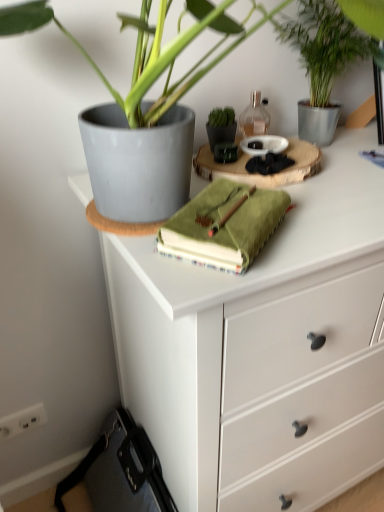
The height and width of the screenshot is (512, 384). What do you see at coordinates (262, 349) in the screenshot?
I see `white matte chest of drawers at upper center` at bounding box center [262, 349].

Locate an element on the screen. The image size is (384, 512). white matte chest of drawers at upper center is located at coordinates (262, 349).

Describe the element at coordinates (224, 225) in the screenshot. This screenshot has width=384, height=512. I see `green suede journal at center` at that location.

In order to face green matte flowerpot at center, should I rotate leftwards or rightwards?

To face it directly, rotate right by 4.324 degrees.

Where is `translucent glass bottle at upper center`? The height and width of the screenshot is (512, 384). translucent glass bottle at upper center is located at coordinates (254, 117).

Does green suede journal at center contain green matte flowerpot at center?

Actually, green matte flowerpot at center is outside green suede journal at center.

Is green suede journal at center in front of or behind green matte flowerpot at center in the image?

Clearly, green suede journal at center is in front of green matte flowerpot at center.

Consider the image. Are green suede journal at center and green matte flowerpot at center located far from each other?

Actually, green suede journal at center and green matte flowerpot at center are a little close together.

Measure the distance from green suede journal at center to green matte flowerpot at center.

green suede journal at center is 11.82 inches away from green matte flowerpot at center.

In the scene shown: Is white matte chest of drawers at upper center in front of or behind translucent glass bottle at upper center in the image?

In the image, white matte chest of drawers at upper center appears in front of translucent glass bottle at upper center.

Can you confirm if white matte chest of drawers at upper center is shorter than translucent glass bottle at upper center?

No.

Consider the image. Is the surface of white matte chest of drawers at upper center in direct contact with translucent glass bottle at upper center?

white matte chest of drawers at upper center is not next to translucent glass bottle at upper center, and they're not touching.

From a real-world perspective, is white matte chest of drawers at upper center under translucent glass bottle at upper center?

Yes, from a real-world perspective, white matte chest of drawers at upper center is beneath translucent glass bottle at upper center.

Is translucent glass bottle at upper center far away from green suede journal at center?

Actually, translucent glass bottle at upper center and green suede journal at center are a little close together.

Could you tell me if translucent glass bottle at upper center is turned towards green suede journal at center?

No.

From a real-world perspective, is translucent glass bottle at upper center above or below green suede journal at center?

translucent glass bottle at upper center is above green suede journal at center.

Considering their positions, is translucent glass bottle at upper center located in front of or behind green suede journal at center?

Clearly, translucent glass bottle at upper center is behind green suede journal at center.

Does point (366, 38) come closer to viewer compared to point (306, 293)?

No, (366, 38) is behind (306, 293).

Who is shorter, green leafy plant at upper right or white matte chest of drawers at upper center?

Standing shorter between the two is green leafy plant at upper right.

Can you confirm if green leafy plant at upper right is thinner than white matte chest of drawers at upper center?

Yes, green leafy plant at upper right is thinner than white matte chest of drawers at upper center.

In the scene shown: Can you tell me how much green suede journal at center and white matte chest of drawers at upper center differ in facing direction?

The facing directions of green suede journal at center and white matte chest of drawers at upper center are 30.5 degrees apart.

Which of these two, green suede journal at center or white matte chest of drawers at upper center, stands taller?

With more height is white matte chest of drawers at upper center.

Is the surface of green suede journal at center in direct contact with white matte chest of drawers at upper center?

No, green suede journal at center is not touching white matte chest of drawers at upper center.

From a real-world perspective, between green suede journal at center and white matte chest of drawers at upper center, who is vertically higher?

From a 3D spatial view, green suede journal at center is above.

From the picture: Considering the sizes of objects green matte flowerpot at center and translucent glass bottle at upper center in the image provided, who is bigger, green matte flowerpot at center or translucent glass bottle at upper center?

translucent glass bottle at upper center.

Based on the photo, is green matte flowerpot at center to the left or to the right of translucent glass bottle at upper center in the image?

green matte flowerpot at center is to the left of translucent glass bottle at upper center.

From a real-world perspective, who is located lower, green matte flowerpot at center or translucent glass bottle at upper center?

green matte flowerpot at center is physically lower.

Which is in front, point (222, 141) or point (255, 130)?

Point (222, 141)

Is translucent glass bottle at upper center positioned with its back to green matte flowerpot at center?

No.

How many degrees apart are the facing directions of translucent glass bottle at upper center and green matte flowerpot at center?

There is a 1.47-degree angle between the facing directions of translucent glass bottle at upper center and green matte flowerpot at center.

Who is bigger, translucent glass bottle at upper center or green matte flowerpot at center?

translucent glass bottle at upper center is bigger.

In terms of width, does translucent glass bottle at upper center look wider or thinner when compared to green matte flowerpot at center?

Clearly, translucent glass bottle at upper center has more width compared to green matte flowerpot at center.

Image resolution: width=384 pixels, height=512 pixels. In order to click on journal below the green matte flowerpot at center (from the image's perspective) in this screenshot , I will do `click(224, 225)`.

Where is `bottle that is behind the white matte chest of drawers at upper center`? This screenshot has height=512, width=384. bottle that is behind the white matte chest of drawers at upper center is located at coordinates (254, 117).

Which object lies further to the anchor point translucent glass bottle at upper center, green matte flowerpot at center or green leafy plant at upper right?

Among the two, green leafy plant at upper right is located further to translucent glass bottle at upper center.

Looking at the image, which one is located closer to green leafy plant at upper right, green matte flowerpot at center or translucent glass bottle at upper center?

Among the two, translucent glass bottle at upper center is located nearer to green leafy plant at upper right.

From the image, which object appears to be nearer to green leafy plant at upper right, green suede journal at center or green matte flowerpot at center?

green matte flowerpot at center.

Considering their positions, is green suede journal at center positioned further to green matte flowerpot at center than translucent glass bottle at upper center?

green suede journal at center is positioned further to the anchor green matte flowerpot at center.

From the image, which object appears to be nearer to green suede journal at center, translucent glass bottle at upper center or green leafy plant at upper right?

Among the two, translucent glass bottle at upper center is located nearer to green suede journal at center.

From the image, which object appears to be farther from green leafy plant at upper right, translucent glass bottle at upper center or white matte chest of drawers at upper center?

The object further to green leafy plant at upper right is white matte chest of drawers at upper center.

From the image, which object appears to be farther from green leafy plant at upper right, translucent glass bottle at upper center or green suede journal at center?

Based on the image, green suede journal at center appears to be further to green leafy plant at upper right.

Estimate the real-world distances between objects in this image. Which object is further from white matte chest of drawers at upper center, green matte flowerpot at center or green suede journal at center?

Among the two, green matte flowerpot at center is located further to white matte chest of drawers at upper center.

You are a GUI agent. You are given a task and a screenshot of the screen. Output one action in this format:
    pyautogui.click(x=<x>, y=<y>)
    Task: Click on the bottle between green matte flowerpot at center and green leafy plant at upper right from left to right
    The width and height of the screenshot is (384, 512).
    Given the screenshot: What is the action you would take?
    pyautogui.click(x=254, y=117)

Where is `bottle between green leafy plant at upper right and white matte chest of drawers at upper center from top to bottom`? bottle between green leafy plant at upper right and white matte chest of drawers at upper center from top to bottom is located at coordinates (254, 117).

Identify the location of journal between green leafy plant at upper right and white matte chest of drawers at upper center vertically. This screenshot has width=384, height=512. (224, 225).

This screenshot has width=384, height=512. I want to click on journal between translucent glass bottle at upper center and white matte chest of drawers at upper center vertically, so click(x=224, y=225).